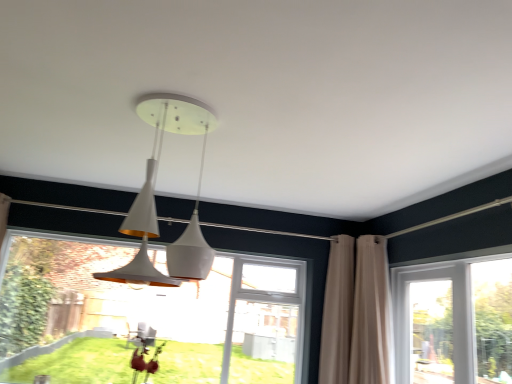
What is the approximate width of beige fabric curtain at right, which ranks as the 1th curtain in right-to-left order?

beige fabric curtain at right, which ranks as the 1th curtain in right-to-left order, is 42.71 centimeters in width.

Find the location of a particular element. beige fabric curtain at right, which ranks as the second curtain in left-to-right order is located at coordinates (356, 313).

What are the coordinates of `clear glass door at right, positioned as the first window in right-to-left order` in the screenshot? It's located at (454, 321).

Where is `white glossy pendant light at center`? white glossy pendant light at center is located at coordinates (154, 198).

Describe the element at coordinates (337, 312) in the screenshot. I see `beige fabric curtain at right, which is the first curtain in left-to-right order` at that location.

Locate an element on the screen. transparent glass window at lower left, positioned as the first window in left-to-right order is located at coordinates (146, 316).

Based on the photo, can you tell me how much white glossy pendant light at center and transparent glass window at lower left, positioned as the first window in left-to-right order, differ in facing direction?

There is a 0.255-degree angle between the facing directions of white glossy pendant light at center and transparent glass window at lower left, positioned as the first window in left-to-right order.

Is white glossy pendant light at center outside of transparent glass window at lower left, the 2th window when ordered from right to left?

That's correct, white glossy pendant light at center is outside of transparent glass window at lower left, the 2th window when ordered from right to left.

From the picture: Considering the relative sizes of white glossy pendant light at center and transparent glass window at lower left, the 2th window when ordered from right to left, in the image provided, is white glossy pendant light at center taller than transparent glass window at lower left, the 2th window when ordered from right to left,?

No.

Between white glossy pendant light at center and transparent glass window at lower left, the 2th window when ordered from right to left, which one appears on the right side from the viewer's perspective?

white glossy pendant light at center.

Considering the relative sizes of transparent glass window at lower left, the 2th window when ordered from right to left, and beige fabric curtain at right, which ranks as the 1th curtain in right-to-left order, in the image provided, is transparent glass window at lower left, the 2th window when ordered from right to left, shorter than beige fabric curtain at right, which ranks as the 1th curtain in right-to-left order,?

No, transparent glass window at lower left, the 2th window when ordered from right to left, is not shorter than beige fabric curtain at right, which ranks as the 1th curtain in right-to-left order.

Considering the points (50, 295) and (373, 316), which point is behind, point (50, 295) or point (373, 316)?

The point (50, 295) is behind.

Can you confirm if transparent glass window at lower left, the 2th window when ordered from right to left, is wider than beige fabric curtain at right, which ranks as the second curtain in left-to-right order?

In fact, transparent glass window at lower left, the 2th window when ordered from right to left, might be narrower than beige fabric curtain at right, which ranks as the second curtain in left-to-right order.

In terms of size, does transparent glass window at lower left, the 2th window when ordered from right to left, appear bigger or smaller than beige fabric curtain at right, which ranks as the 1th curtain in right-to-left order?

Considering their sizes, transparent glass window at lower left, the 2th window when ordered from right to left, takes up more space than beige fabric curtain at right, which ranks as the 1th curtain in right-to-left order.

How many degrees apart are the facing directions of transparent glass window at lower left, the 2th window when ordered from right to left, and white glossy pendant light at center?

The angle between the facing direction of transparent glass window at lower left, the 2th window when ordered from right to left, and the facing direction of white glossy pendant light at center is 0.255 degrees.

From a real-world perspective, is transparent glass window at lower left, positioned as the first window in left-to-right order, on white glossy pendant light at center?

No.

Is transparent glass window at lower left, the 2th window when ordered from right to left, smaller than white glossy pendant light at center?

Actually, transparent glass window at lower left, the 2th window when ordered from right to left, might be larger than white glossy pendant light at center.

Is transparent glass window at lower left, positioned as the first window in left-to-right order, aimed at white glossy pendant light at center?

Yes, transparent glass window at lower left, positioned as the first window in left-to-right order, is oriented towards white glossy pendant light at center.

Identify the location of curtain that is the 1st one above the clear glass door at right, positioned as the first window in right-to-left order (from a real-world perspective). (356, 313).

How distant is clear glass door at right, positioned as the first window in right-to-left order, from beige fabric curtain at right, which ranks as the second curtain in left-to-right order?

clear glass door at right, positioned as the first window in right-to-left order, is 19.57 inches away from beige fabric curtain at right, which ranks as the second curtain in left-to-right order.

Based on the photo, between clear glass door at right, positioned as the first window in right-to-left order, and beige fabric curtain at right, which ranks as the 1th curtain in right-to-left order, which one appears on the left side from the viewer's perspective?

beige fabric curtain at right, which ranks as the 1th curtain in right-to-left order.

Is clear glass door at right, positioned as the first window in right-to-left order, in contact with beige fabric curtain at right, which ranks as the 1th curtain in right-to-left order?

clear glass door at right, positioned as the first window in right-to-left order, and beige fabric curtain at right, which ranks as the 1th curtain in right-to-left order, are not in contact.

From a real-world perspective, which is physically above, clear glass door at right, positioned as the first window in right-to-left order, or beige fabric curtain at right, which is the first curtain in left-to-right order?

In real-world perspective, beige fabric curtain at right, which is the first curtain in left-to-right order, is above.

How distant is clear glass door at right, positioned as the first window in right-to-left order, from beige fabric curtain at right, which is the first curtain in left-to-right order?

clear glass door at right, positioned as the first window in right-to-left order, and beige fabric curtain at right, which is the first curtain in left-to-right order, are 27.73 inches apart.

From the image's perspective, is clear glass door at right, positioned as the first window in right-to-left order, above beige fabric curtain at right, arranged as the second curtain when viewed from the right?

Incorrect, from the image's perspective, clear glass door at right, positioned as the first window in right-to-left order, is lower than beige fabric curtain at right, arranged as the second curtain when viewed from the right.

Does clear glass door at right, positioned as the first window in right-to-left order, appear on the right side of beige fabric curtain at right, arranged as the second curtain when viewed from the right?

Correct, you'll find clear glass door at right, positioned as the first window in right-to-left order, to the right of beige fabric curtain at right, arranged as the second curtain when viewed from the right.

From the image's perspective, between beige fabric curtain at right, which is the first curtain in left-to-right order, and beige fabric curtain at right, which ranks as the second curtain in left-to-right order, who is located below?

beige fabric curtain at right, which is the first curtain in left-to-right order, appears lower in the image.

Which of these two, beige fabric curtain at right, which is the first curtain in left-to-right order, or beige fabric curtain at right, which ranks as the 1th curtain in right-to-left order, is bigger?

Bigger between the two is beige fabric curtain at right, which ranks as the 1th curtain in right-to-left order.

Is beige fabric curtain at right, which is the first curtain in left-to-right order, at the right side of beige fabric curtain at right, which ranks as the 1th curtain in right-to-left order?

No.

Is beige fabric curtain at right, which ranks as the second curtain in left-to-right order, turned away from beige fabric curtain at right, which is the first curtain in left-to-right order?

No, beige fabric curtain at right, which ranks as the second curtain in left-to-right order, is not facing away from beige fabric curtain at right, which is the first curtain in left-to-right order.

Where is `curtain on the right of beige fabric curtain at right, which is the first curtain in left-to-right order`? curtain on the right of beige fabric curtain at right, which is the first curtain in left-to-right order is located at coordinates (356, 313).

Are beige fabric curtain at right, which ranks as the 1th curtain in right-to-left order, and beige fabric curtain at right, arranged as the second curtain when viewed from the right, located far from each other?

No.

Considering the positions of point (327, 360) and point (339, 268), is point (327, 360) closer or farther from the camera than point (339, 268)?

Clearly, point (327, 360) is closer to the camera than point (339, 268).

Find the location of a particular element. window on the left of white glossy pendant light at center is located at coordinates (146, 316).

The height and width of the screenshot is (384, 512). I want to click on the 2nd curtain counting from the right of the transparent glass window at lower left, positioned as the first window in left-to-right order, so click(356, 313).

Which object lies further to the anchor point white glossy pendant light at center, beige fabric curtain at right, which ranks as the 1th curtain in right-to-left order, or transparent glass window at lower left, positioned as the first window in left-to-right order?

transparent glass window at lower left, positioned as the first window in left-to-right order, lies further to white glossy pendant light at center than the other object.

Which object lies nearer to the anchor point beige fabric curtain at right, arranged as the second curtain when viewed from the right, transparent glass window at lower left, positioned as the first window in left-to-right order, or clear glass door at right, positioned as the first window in right-to-left order?

clear glass door at right, positioned as the first window in right-to-left order, is positioned closer to the anchor beige fabric curtain at right, arranged as the second curtain when viewed from the right.

Considering their positions, is white glossy pendant light at center positioned further to beige fabric curtain at right, which is the first curtain in left-to-right order, than clear glass door at right, positioned as the first window in right-to-left order?

white glossy pendant light at center.

Considering their positions, is white glossy pendant light at center positioned closer to clear glass door at right, acting as the 2th window starting from the left, than beige fabric curtain at right, which ranks as the 1th curtain in right-to-left order?

Among the two, beige fabric curtain at right, which ranks as the 1th curtain in right-to-left order, is located nearer to clear glass door at right, acting as the 2th window starting from the left.

Based on their spatial positions, is beige fabric curtain at right, which ranks as the 1th curtain in right-to-left order, or transparent glass window at lower left, positioned as the first window in left-to-right order, further from clear glass door at right, positioned as the first window in right-to-left order?

transparent glass window at lower left, positioned as the first window in left-to-right order.

Which object lies nearer to the anchor point beige fabric curtain at right, arranged as the second curtain when viewed from the right, beige fabric curtain at right, which ranks as the second curtain in left-to-right order, or white glossy pendant light at center?

beige fabric curtain at right, which ranks as the second curtain in left-to-right order, is positioned closer to the anchor beige fabric curtain at right, arranged as the second curtain when viewed from the right.

Which object lies nearer to the anchor point clear glass door at right, positioned as the first window in right-to-left order, beige fabric curtain at right, which is the first curtain in left-to-right order, or transparent glass window at lower left, positioned as the first window in left-to-right order?

Based on the image, beige fabric curtain at right, which is the first curtain in left-to-right order, appears to be nearer to clear glass door at right, positioned as the first window in right-to-left order.

Looking at the image, which one is located further to beige fabric curtain at right, which ranks as the second curtain in left-to-right order, white glossy pendant light at center or beige fabric curtain at right, arranged as the second curtain when viewed from the right?

white glossy pendant light at center is further to beige fabric curtain at right, which ranks as the second curtain in left-to-right order.

Locate an element on the screen. The image size is (512, 384). curtain between transparent glass window at lower left, positioned as the first window in left-to-right order, and beige fabric curtain at right, which ranks as the second curtain in left-to-right order, in the horizontal direction is located at coordinates point(337,312).

Image resolution: width=512 pixels, height=384 pixels. In order to click on curtain positioned between white glossy pendant light at center and beige fabric curtain at right, arranged as the second curtain when viewed from the right, from near to far in this screenshot , I will do `click(356, 313)`.

Where is `window between white glossy pendant light at center and beige fabric curtain at right, which ranks as the second curtain in left-to-right order, from front to back`? window between white glossy pendant light at center and beige fabric curtain at right, which ranks as the second curtain in left-to-right order, from front to back is located at coordinates (454, 321).

I want to click on curtain positioned between clear glass door at right, acting as the 2th window starting from the left, and beige fabric curtain at right, which is the first curtain in left-to-right order, from near to far, so click(x=356, y=313).